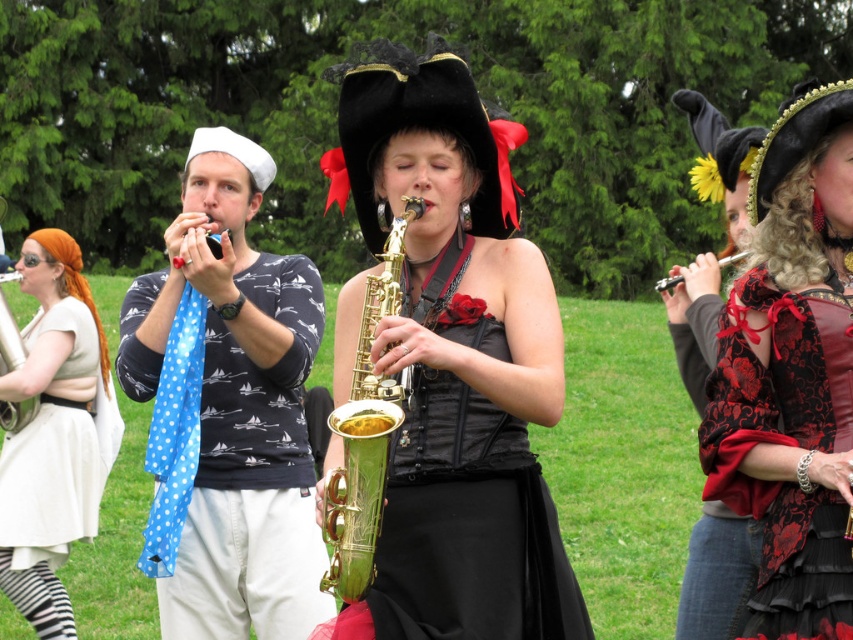
Question: Is blue dotted scarf at left thinner than velvet red corset at center?

Choices:
 (A) no
 (B) yes

Answer: (A)

Question: Which object is closer to the camera taking this photo?

Choices:
 (A) velvet red corset at center
 (B) gold polished saxophone at center
 (C) shiny gold saxophone at center

Answer: (B)

Question: Which point is farther to the camera?

Choices:
 (A) (463, 420)
 (B) (849, 563)

Answer: (A)

Question: Does velvet red vest at center appear on the right side of silver metallic flute at upper right?

Choices:
 (A) yes
 (B) no

Answer: (B)

Question: Is shiny gold saxophone at center thinner than matte green saxophone at center?

Choices:
 (A) no
 (B) yes

Answer: (A)

Question: Which point is farther to the camera?

Choices:
 (A) blue dotted scarf at left
 (B) matte green saxophone at center
 (C) shiny gold saxophone at center

Answer: (B)